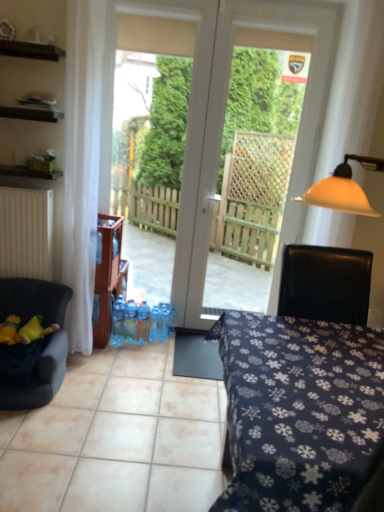
This screenshot has width=384, height=512. I want to click on vacant area that is situated to the right of blue plastic bottle at center, which is the 2th bottle from right to left, so click(180, 340).